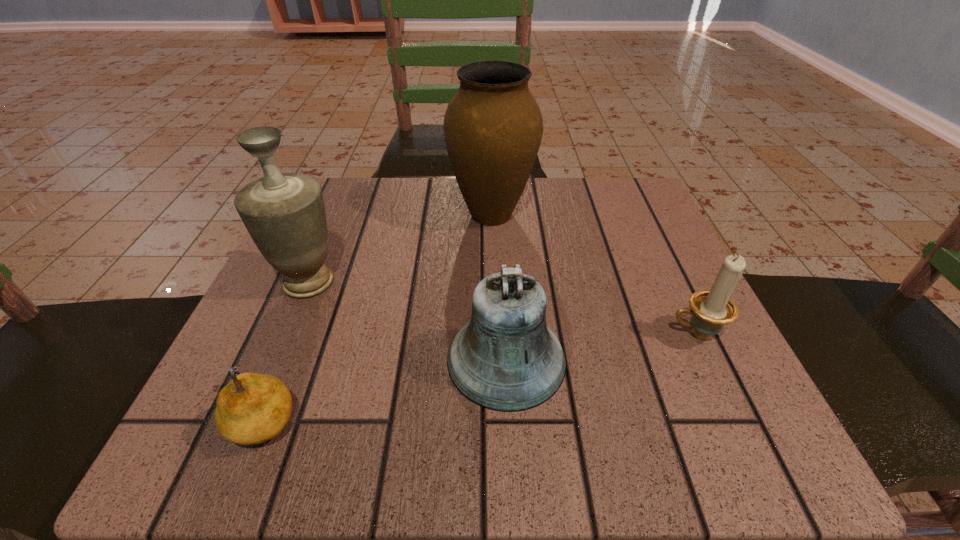
This screenshot has width=960, height=540. I want to click on object present at the near left corner, so click(253, 408).

In the image, there is a desktop. Find the location of `free space at the far edge`. free space at the far edge is located at coordinates (560, 204).

In the image, there is a desktop. Where is `vacant space at the near edge`? This screenshot has height=540, width=960. vacant space at the near edge is located at coordinates (489, 434).

Find the location of `vacant area at the left edge`. vacant area at the left edge is located at coordinates (347, 252).

The height and width of the screenshot is (540, 960). In the image, there is a desktop. In order to click on vacant space at the right edge in this screenshot , I will do `click(680, 286)`.

In the image, there is a desktop. Where is `vacant space at the far left corner`? vacant space at the far left corner is located at coordinates (377, 184).

I want to click on vacant region at the far right corner of the desktop, so click(633, 188).

The width and height of the screenshot is (960, 540). What are the coordinates of `free spot at the near right corner of the desktop` in the screenshot? It's located at (762, 412).

The width and height of the screenshot is (960, 540). I want to click on free space that is in between the shortest object and the farthest object, so click(377, 317).

You are a GUI agent. You are given a task and a screenshot of the screen. Output one action in this format:
    pyautogui.click(x=<x>, y=<y>)
    Task: Click on the free space that is in between the farthest object and the pear
    The image size is (960, 540).
    Given the screenshot: What is the action you would take?
    pyautogui.click(x=377, y=317)